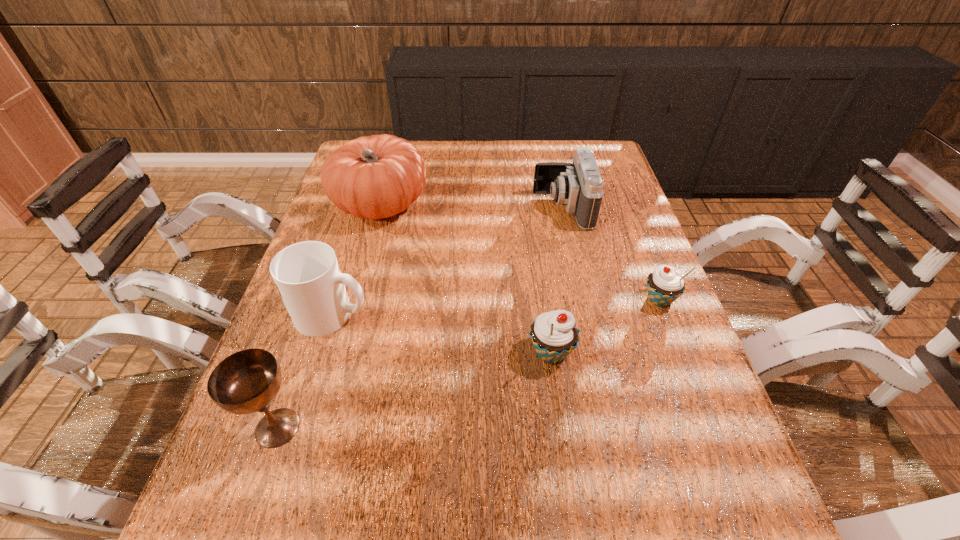
You are a GUI agent. You are given a task and a screenshot of the screen. Output one action in this format:
    pyautogui.click(x=<x>, y=<y>)
    Task: Click on the unoccupied area between the pumpkin and the shortest object
    This screenshot has height=540, width=960.
    Given the screenshot: What is the action you would take?
    pyautogui.click(x=520, y=252)

In order to click on free space between the camera and the mug in this screenshot , I will do `click(447, 261)`.

The height and width of the screenshot is (540, 960). Find the location of `vacant space that's between the shorter cupcake and the nearer cupcake`. vacant space that's between the shorter cupcake and the nearer cupcake is located at coordinates (605, 326).

Locate an element on the screen. This screenshot has width=960, height=540. free space between the mug and the taller cupcake is located at coordinates (442, 333).

The image size is (960, 540). I want to click on vacant area that lies between the camera and the mug, so click(447, 261).

Where is `free spot between the left cupcake and the farther cupcake`? Image resolution: width=960 pixels, height=540 pixels. free spot between the left cupcake and the farther cupcake is located at coordinates (605, 326).

This screenshot has width=960, height=540. I want to click on free point between the nearer cupcake and the mug, so point(442,333).

Locate which object ranks second in proximity to the nearest object. Please provide its 2D coordinates. Your answer should be formatted as a tuple, i.e. [(x, y)], where the tuple contains the x and y coordinates of a point satisfying the conditions above.

[(554, 334)]

You are a GUI agent. You are given a task and a screenshot of the screen. Output one action in this format:
    pyautogui.click(x=<x>, y=<y>)
    Task: Click on the object that ranks as the third closest to the camera
    The width and height of the screenshot is (960, 540).
    Given the screenshot: What is the action you would take?
    pyautogui.click(x=554, y=334)

Where is `free space that satisfies the following two spatial constraints: 1. on the back side of the pumpkin; 2. on the left side of the nearest object`? This screenshot has height=540, width=960. free space that satisfies the following two spatial constraints: 1. on the back side of the pumpkin; 2. on the left side of the nearest object is located at coordinates (353, 205).